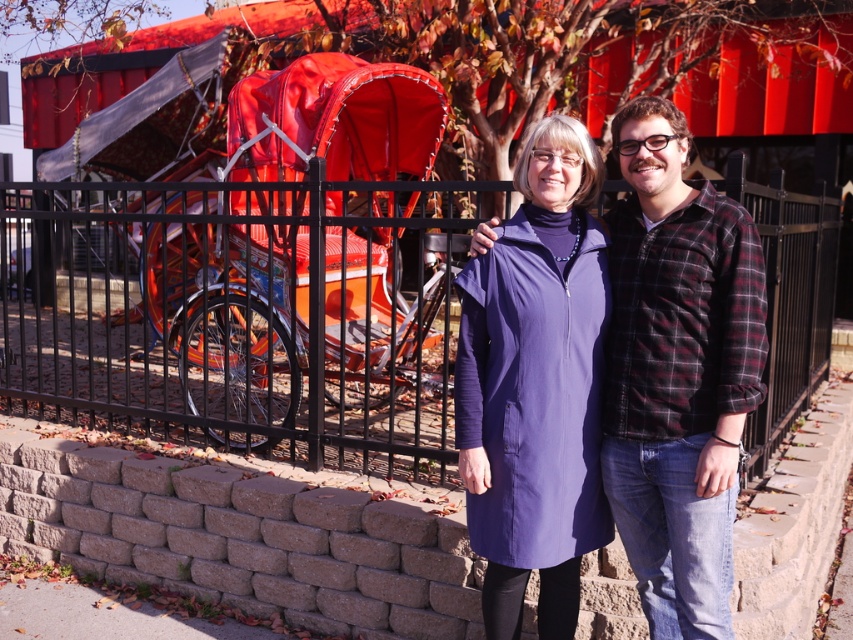
Question: Does purple matte coat at center have a greater width compared to purple smooth coat at center?

Choices:
 (A) no
 (B) yes

Answer: (A)

Question: Does black metal fence at center have a larger size compared to purple matte coat at center?

Choices:
 (A) no
 (B) yes

Answer: (A)

Question: Among these objects, which one is nearest to the camera?

Choices:
 (A) black metal fence at center
 (B) purple matte coat at center
 (C) purple smooth coat at center

Answer: (B)

Question: Which object is the closest to the purple matte coat at center?

Choices:
 (A) black metal fence at center
 (B) purple smooth coat at center

Answer: (B)

Question: Is black metal fence at center positioned behind purple smooth coat at center?

Choices:
 (A) no
 (B) yes

Answer: (B)

Question: Which point is closer to the camera?

Choices:
 (A) (737, 253)
 (B) (155, 323)
 (C) (569, 397)

Answer: (A)